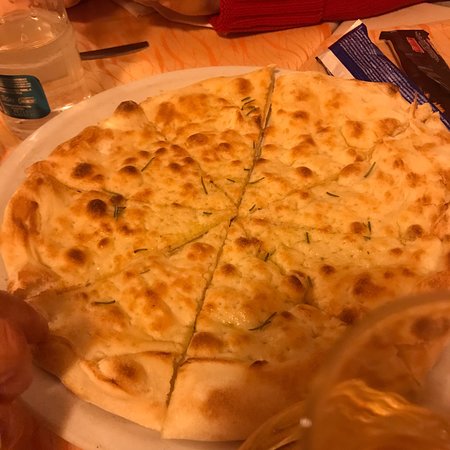
Locate an element on the screen. This screenshot has width=450, height=450. handle of the utensil to the left is located at coordinates (125, 48).